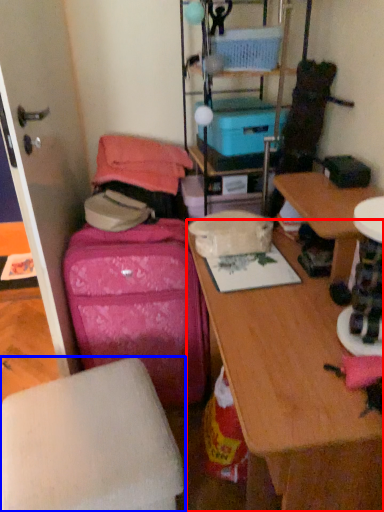
Question: Among these objects, which one is nearest to the camera, desk (highlighted by a red box) or furniture (highlighted by a blue box)?

Choices:
 (A) desk
 (B) furniture

Answer: (A)